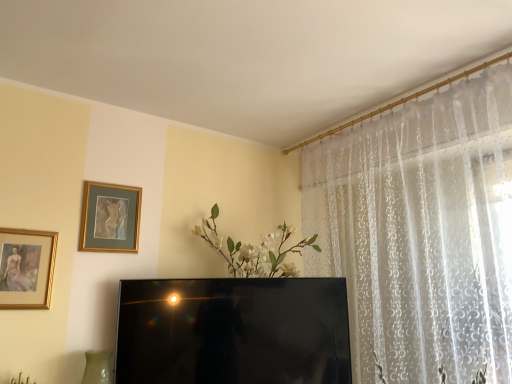
Locate an element on the screen. The image size is (512, 384). gold-framed painting at left, which is the first picture frame in front-to-back order is located at coordinates (26, 268).

Identify the location of gold-framed painting at upper left, which ranks as the second picture frame in left-to-right order. pyautogui.click(x=110, y=218).

The height and width of the screenshot is (384, 512). Describe the element at coordinates (110, 218) in the screenshot. I see `gold-framed painting at upper left, which ranks as the second picture frame in left-to-right order` at that location.

This screenshot has width=512, height=384. I want to click on gold-framed painting at left, which is the second picture frame in right-to-left order, so 26,268.

Measure the distance between gold-framed painting at upper left, marked as the 1th picture frame in a back-to-front arrangement, and gold-framed painting at left, marked as the 2th picture frame in a back-to-front arrangement.

They are 10.28 inches apart.

From the image's perspective, which one is positioned lower, gold-framed painting at upper left, which is counted as the first picture frame, starting from the right, or gold-framed painting at left, acting as the first picture frame starting from the left?

From the image's view, gold-framed painting at left, acting as the first picture frame starting from the left, is below.

Does point (130, 249) appear closer or farther from the camera than point (25, 237)?

Point (130, 249).

Would you consider gold-framed painting at upper left, which ranks as the second picture frame in left-to-right order, to be distant from gold-framed painting at left, marked as the 2th picture frame in a back-to-front arrangement?

Actually, gold-framed painting at upper left, which ranks as the second picture frame in left-to-right order, and gold-framed painting at left, marked as the 2th picture frame in a back-to-front arrangement, are a little close together.

From the image's perspective, is black glossy television at center on gold-framed painting at upper left, which ranks as the second picture frame in left-to-right order?

→ No.

How different are the orientations of black glossy television at center and gold-framed painting at upper left, which ranks as the second picture frame in left-to-right order, in degrees?

They differ by 27.3 degrees in their facing directions.

Is black glossy television at center turned away from gold-framed painting at upper left, marked as the 1th picture frame in a back-to-front arrangement?

That's not correct — black glossy television at center is not looking away from gold-framed painting at upper left, marked as the 1th picture frame in a back-to-front arrangement.

Is point (291, 300) closer or farther from the camera than point (130, 217)?

Clearly, point (291, 300) is closer to the camera than point (130, 217).

Is black glossy television at center not close to gold-framed painting at left, which is the first picture frame in front-to-back order?

They are positioned close to each other.

Is black glossy television at center facing towards gold-framed painting at left, marked as the 2th picture frame in a back-to-front arrangement?

No, black glossy television at center is not oriented towards gold-framed painting at left, marked as the 2th picture frame in a back-to-front arrangement.

Is black glossy television at center taller than gold-framed painting at left, which is the second picture frame in right-to-left order?

Indeed, black glossy television at center has a greater height compared to gold-framed painting at left, which is the second picture frame in right-to-left order.

Considering the positions of point (106, 201) and point (138, 306), is point (106, 201) closer or farther from the camera than point (138, 306)?

Clearly, point (106, 201) is more distant from the camera than point (138, 306).

Is gold-framed painting at upper left, marked as the 1th picture frame in a back-to-front arrangement, bigger than black glossy television at center?

Actually, gold-framed painting at upper left, marked as the 1th picture frame in a back-to-front arrangement, might be smaller than black glossy television at center.

Consider the image. Is gold-framed painting at upper left, the 2th picture frame from the front, thinner than black glossy television at center?

Yes, gold-framed painting at upper left, the 2th picture frame from the front, is thinner than black glossy television at center.

From the image's perspective, does gold-framed painting at upper left, marked as the 1th picture frame in a back-to-front arrangement, appear higher than black glossy television at center?

Correct, gold-framed painting at upper left, marked as the 1th picture frame in a back-to-front arrangement, appears higher than black glossy television at center in the image.

Would you say gold-framed painting at left, marked as the 2th picture frame in a back-to-front arrangement, is outside gold-framed painting at upper left, which ranks as the second picture frame in left-to-right order?

Indeed, gold-framed painting at left, marked as the 2th picture frame in a back-to-front arrangement, is completely outside gold-framed painting at upper left, which ranks as the second picture frame in left-to-right order.

In the scene shown: Is gold-framed painting at left, which is the first picture frame in front-to-back order, in front of gold-framed painting at upper left, which ranks as the second picture frame in left-to-right order?

Yes, it is in front of gold-framed painting at upper left, which ranks as the second picture frame in left-to-right order.

In the image, there is a gold-framed painting at left, acting as the first picture frame starting from the left. Where is `picture frame above it (from the image's perspective)`? Image resolution: width=512 pixels, height=384 pixels. picture frame above it (from the image's perspective) is located at coordinates (110, 218).

Which object is further away from the camera taking this photo, gold-framed painting at left, acting as the first picture frame starting from the left, or black glossy television at center?

black glossy television at center is further away from the camera.

What's the angular difference between gold-framed painting at left, marked as the 2th picture frame in a back-to-front arrangement, and black glossy television at center's facing directions?

gold-framed painting at left, marked as the 2th picture frame in a back-to-front arrangement, and black glossy television at center are facing 27.5 degrees away from each other.

Does gold-framed painting at left, marked as the 2th picture frame in a back-to-front arrangement, have a greater height compared to black glossy television at center?

In fact, gold-framed painting at left, marked as the 2th picture frame in a back-to-front arrangement, may be shorter than black glossy television at center.

Looking at the image, does gold-framed painting at left, which is the first picture frame in front-to-back order, seem bigger or smaller compared to black glossy television at center?

Considering their sizes, gold-framed painting at left, which is the first picture frame in front-to-back order, takes up less space than black glossy television at center.

Locate an element on the screen. This screenshot has width=512, height=384. picture frame on the left side of gold-framed painting at upper left, marked as the 1th picture frame in a back-to-front arrangement is located at coordinates (26, 268).

Identify the location of television that appears below the gold-framed painting at upper left, which ranks as the second picture frame in left-to-right order (from the image's perspective). This screenshot has width=512, height=384. coord(233,331).

Looking at the image, which one is located further to black glossy television at center, gold-framed painting at left, which is the second picture frame in right-to-left order, or gold-framed painting at upper left, which ranks as the second picture frame in left-to-right order?

gold-framed painting at left, which is the second picture frame in right-to-left order, is further to black glossy television at center.

In the scene shown: When comparing their distances from gold-framed painting at upper left, marked as the 1th picture frame in a back-to-front arrangement, does black glossy television at center or gold-framed painting at left, marked as the 2th picture frame in a back-to-front arrangement, seem closer?

Based on the image, gold-framed painting at left, marked as the 2th picture frame in a back-to-front arrangement, appears to be nearer to gold-framed painting at upper left, marked as the 1th picture frame in a back-to-front arrangement.

Estimate the real-world distances between objects in this image. Which object is further from gold-framed painting at upper left, marked as the 1th picture frame in a back-to-front arrangement, gold-framed painting at left, acting as the first picture frame starting from the left, or black glossy television at center?

Based on the image, black glossy television at center appears to be further to gold-framed painting at upper left, marked as the 1th picture frame in a back-to-front arrangement.

When comparing their distances from black glossy television at center, does gold-framed painting at upper left, which is counted as the first picture frame, starting from the right, or gold-framed painting at left, which is the first picture frame in front-to-back order, seem closer?

The object closer to black glossy television at center is gold-framed painting at upper left, which is counted as the first picture frame, starting from the right.

Estimate the real-world distances between objects in this image. Which object is further from gold-framed painting at left, which is the first picture frame in front-to-back order, black glossy television at center or gold-framed painting at upper left, the 2th picture frame from the front?

black glossy television at center is positioned further to the anchor gold-framed painting at left, which is the first picture frame in front-to-back order.

When comparing their distances from gold-framed painting at left, which is the second picture frame in right-to-left order, does gold-framed painting at upper left, which ranks as the second picture frame in left-to-right order, or black glossy television at center seem further?

black glossy television at center is further to gold-framed painting at left, which is the second picture frame in right-to-left order.

Where is `picture frame between gold-framed painting at left, marked as the 2th picture frame in a back-to-front arrangement, and black glossy television at center`? picture frame between gold-framed painting at left, marked as the 2th picture frame in a back-to-front arrangement, and black glossy television at center is located at coordinates (110, 218).